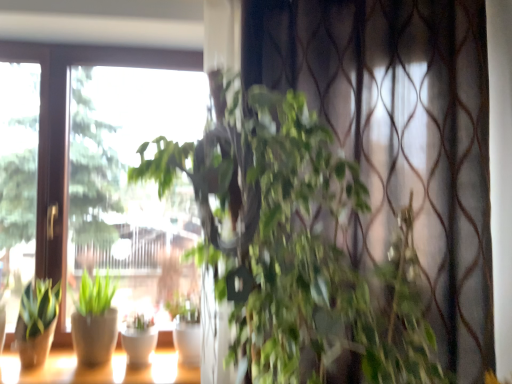
Question: Is matte white pots at lower left positioned behind green matte plant at lower left, the 2th houseplant positioned from the front?

Choices:
 (A) yes
 (B) no

Answer: (B)

Question: Can you confirm if matte white pots at lower left is thinner than green matte plant at lower left, the 2th houseplant positioned from the front?

Choices:
 (A) yes
 (B) no

Answer: (B)

Question: Is matte white pots at lower left bigger than green matte plant at lower left, which is the second houseplant from back to front?

Choices:
 (A) yes
 (B) no

Answer: (A)

Question: From the image's perspective, is matte white pots at lower left on top of green matte plant at lower left, the 1th houseplant from the left?

Choices:
 (A) yes
 (B) no

Answer: (B)

Question: Can you confirm if matte white pots at lower left is smaller than green matte plant at lower left, the 1th houseplant from the left?

Choices:
 (A) no
 (B) yes

Answer: (A)

Question: Can you confirm if matte white pots at lower left is shorter than green matte plant at lower left, arranged as the 3th houseplant when viewed from the right?

Choices:
 (A) yes
 (B) no

Answer: (A)

Question: Can green matte plant at center, which appears as the 1th houseplant when viewed from the back, be found inside matte white pots at lower left?

Choices:
 (A) no
 (B) yes

Answer: (A)

Question: Is matte white pots at lower left far from green matte plant at center, the 3th houseplant positioned from the front?

Choices:
 (A) yes
 (B) no

Answer: (B)

Question: Is matte white pots at lower left further to the viewer compared to green matte plant at center, which appears as the 1th houseplant when viewed from the back?

Choices:
 (A) no
 (B) yes

Answer: (A)

Question: Can you confirm if matte white pots at lower left is taller than green matte plant at center, the 3th houseplant positioned from the front?

Choices:
 (A) yes
 (B) no

Answer: (B)

Question: Considering the relative positions of matte white pots at lower left and green matte plant at center, the 3th houseplant positioned from the front, in the image provided, is matte white pots at lower left to the right of green matte plant at center, the 3th houseplant positioned from the front, from the viewer's perspective?

Choices:
 (A) no
 (B) yes

Answer: (A)

Question: Is matte white pots at lower left smaller than green matte plant at center, the 3th houseplant positioned from the front?

Choices:
 (A) yes
 (B) no

Answer: (B)

Question: Is white glossy flowerpot at center surrounding matte white pots at lower left?

Choices:
 (A) no
 (B) yes

Answer: (A)